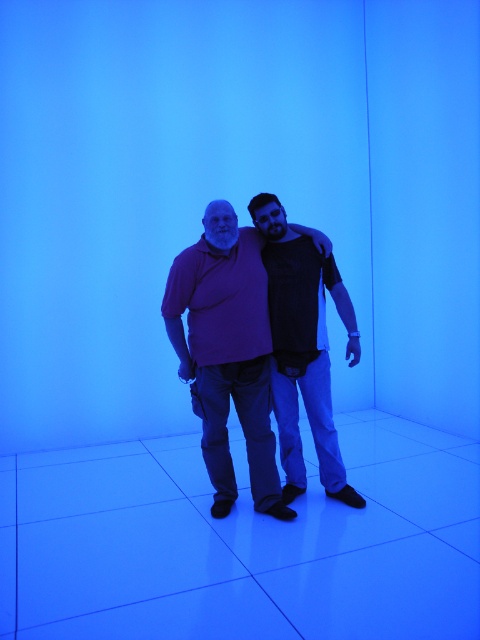
Does purple matte shirt at center have a greater width compared to dark gray t-shirt at center?

Indeed, purple matte shirt at center has a greater width compared to dark gray t-shirt at center.

Is purple matte shirt at center positioned at the back of dark gray t-shirt at center?

No, purple matte shirt at center is in front of dark gray t-shirt at center.

Where is `purple matte shirt at center`? The width and height of the screenshot is (480, 640). purple matte shirt at center is located at coordinates (227, 353).